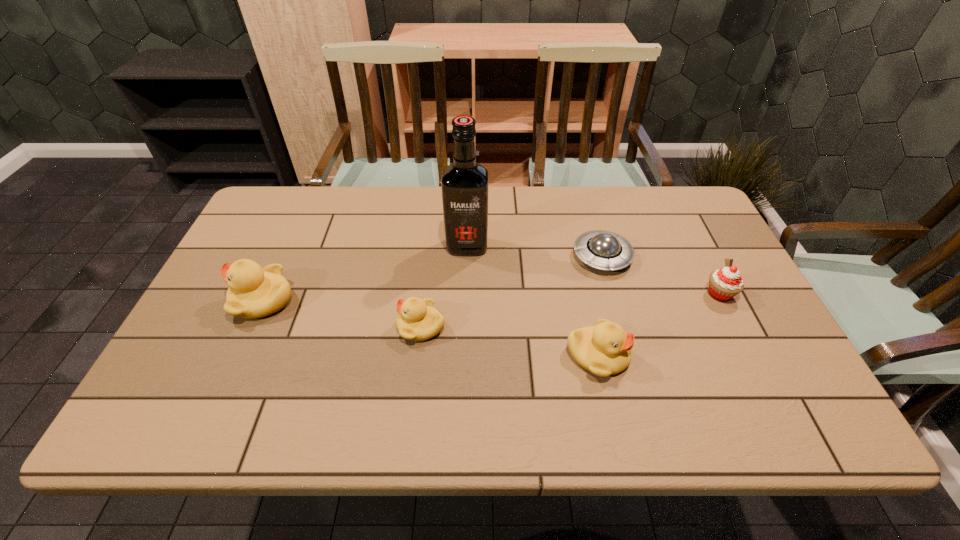
At what (x,y) coordinates should I click in order to perform the action: click on vacant spot to place a duckling on the right. Please return your answer as a coordinate pair (x, y). Looking at the image, I should click on tap(795, 389).